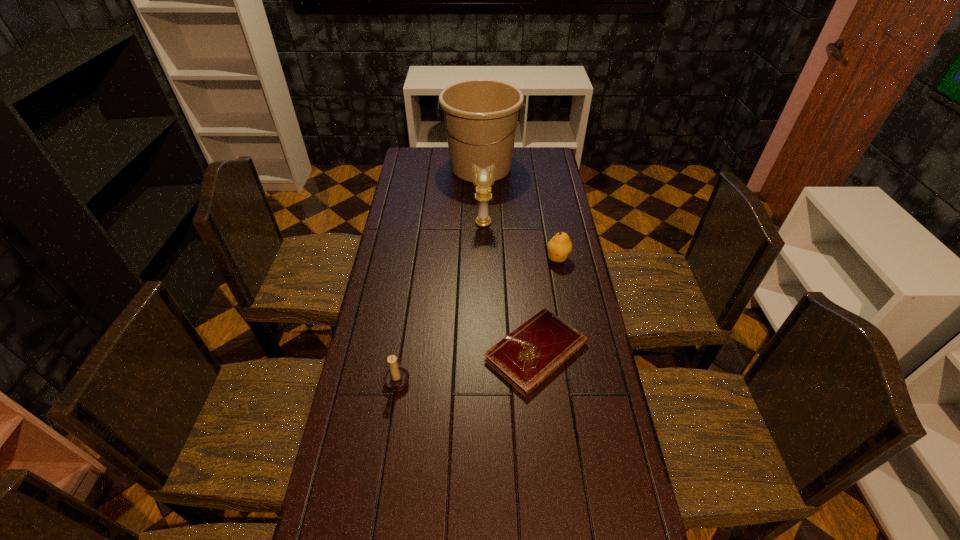
At what (x,y) coordinates should I click in order to perform the action: click on free space that satisfies the following two spatial constraints: 1. on the front-facing side of the notebook; 2. on the right side of the award. Please return your answer as a coordinate pair (x, y). Looking at the image, I should click on (485, 352).

Identify the location of vacant space that satisfies the following two spatial constraints: 1. on the front-facing side of the fourth shortest object; 2. on the wick of the candle holder. (485, 379).